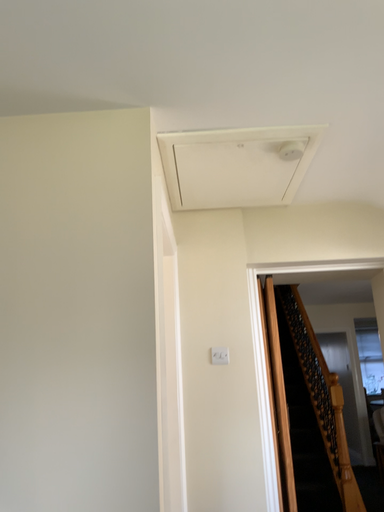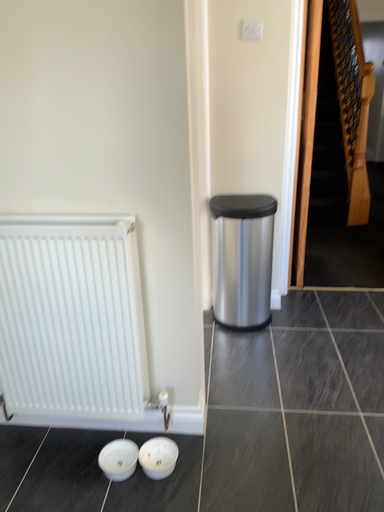
Question: How did the camera likely rotate when shooting the video?

Choices:
 (A) rotated upward
 (B) rotated downward

Answer: (B)